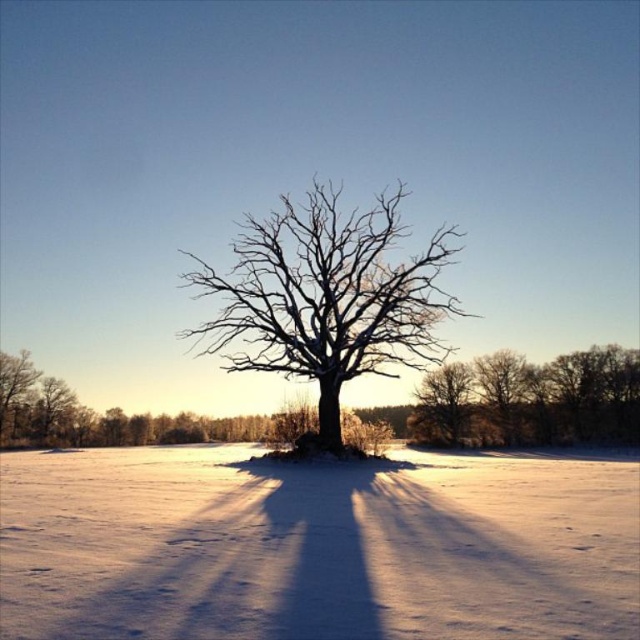
Measure the distance between white powdery snow at center and camera.

A distance of 18.96 feet exists between white powdery snow at center and camera.

Is white powdery snow at center bigger than bare wood tree at center?

Correct, white powdery snow at center is larger in size than bare wood tree at center.

Locate an element on the screen. This screenshot has width=640, height=640. white powdery snow at center is located at coordinates (316, 547).

This screenshot has width=640, height=640. Find the location of `white powdery snow at center`. white powdery snow at center is located at coordinates (316, 547).

This screenshot has width=640, height=640. Describe the element at coordinates (536, 401) in the screenshot. I see `snow-covered branches at center` at that location.

Does point (496, 401) come in front of point (472, 378)?

Yes, point (496, 401) is in front of point (472, 378).

The width and height of the screenshot is (640, 640). Identify the location of snow-covered branches at center. (536, 401).

Can you confirm if white powdery snow at center is taller than snow-covered branches at center?

No.

From the picture: Does white powdery snow at center have a lesser width compared to snow-covered branches at center?

Incorrect, white powdery snow at center's width is not less than snow-covered branches at center's.

Does point (220, 538) come closer to viewer compared to point (586, 420)?

That is True.

Find the location of a particular element. This screenshot has width=640, height=640. white powdery snow at center is located at coordinates (316, 547).